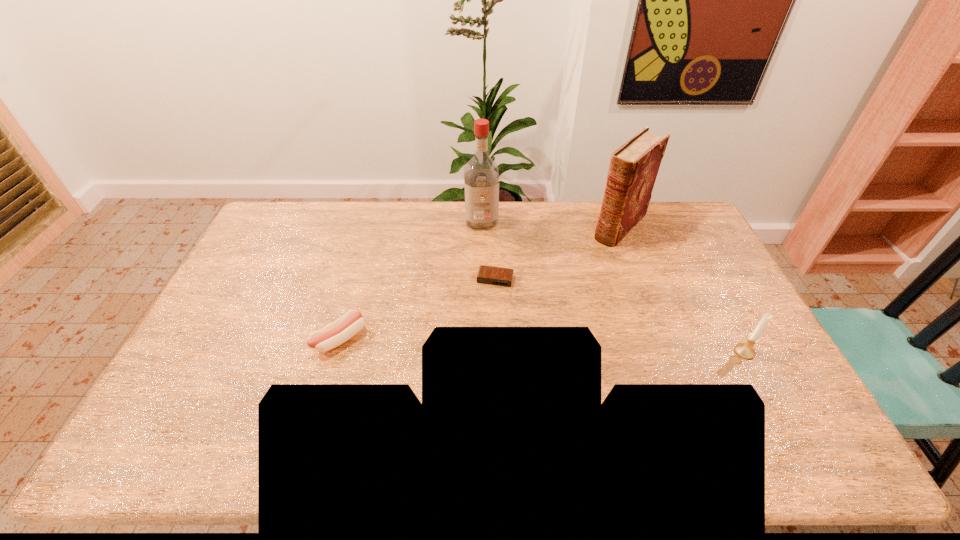
Where is `sausage`? The image size is (960, 540). sausage is located at coordinates (344, 328).

This screenshot has height=540, width=960. In order to click on the second shortest object in this screenshot , I will do `click(344, 328)`.

What are the coordinates of `the third shortest object` in the screenshot? It's located at click(745, 350).

You are a GUI agent. You are given a task and a screenshot of the screen. Output one action in this format:
    pyautogui.click(x=<x>, y=<y>)
    Task: Click on the rightmost object
    
    Given the screenshot: What is the action you would take?
    pyautogui.click(x=745, y=350)

What are the coordinates of `the fourth shortest object` in the screenshot? It's located at [x=634, y=166].

Identify the location of hardback book. (634, 166).

Find the location of a particular element. This screenshot has width=960, height=540. liquor is located at coordinates (481, 176).

Locate an element on the screen. The height and width of the screenshot is (540, 960). the third nearest object is located at coordinates (499, 276).

Identify the location of alarm clock. The image size is (960, 540). pyautogui.click(x=499, y=276).

The width and height of the screenshot is (960, 540). Find the location of `blank space located 0.070m on the back of the leftmost object`. blank space located 0.070m on the back of the leftmost object is located at coordinates (350, 303).